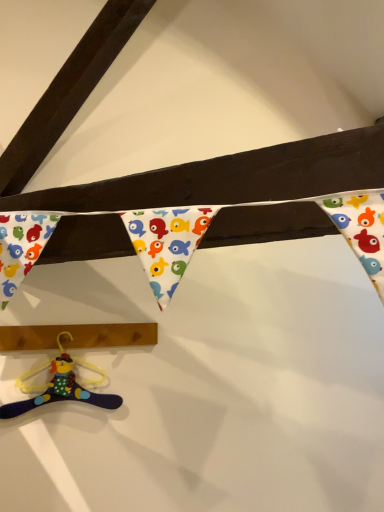
Locate an element on the screen. Image resolution: width=384 pixels, height=512 pixels. free space above wooden plank at lower left (from a real-world perspective) is located at coordinates (86, 318).